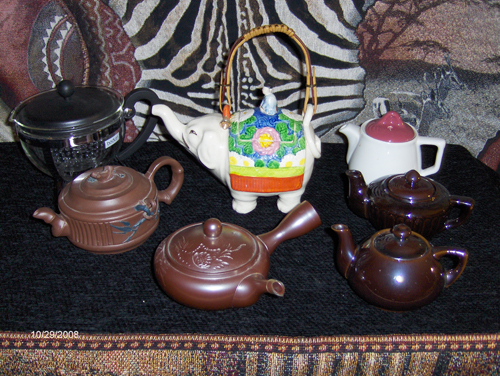
At what (x,y) coordinates should I click in order to perform the action: click on textile. Please return your answer as a coordinate pair (x, y). Looking at the image, I should click on (15, 353), (105, 367), (188, 349), (283, 351), (318, 359), (403, 349), (452, 364), (476, 349).